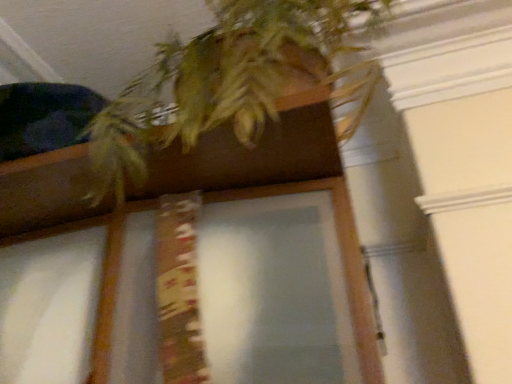
Find the location of a particular element. The image size is (512, 384). green leafy plant at upper center is located at coordinates (231, 81).

What do you see at coordinates (231, 81) in the screenshot?
I see `green leafy plant at upper center` at bounding box center [231, 81].

Locate an element on the screen. This screenshot has width=512, height=384. green leafy plant at upper center is located at coordinates (231, 81).